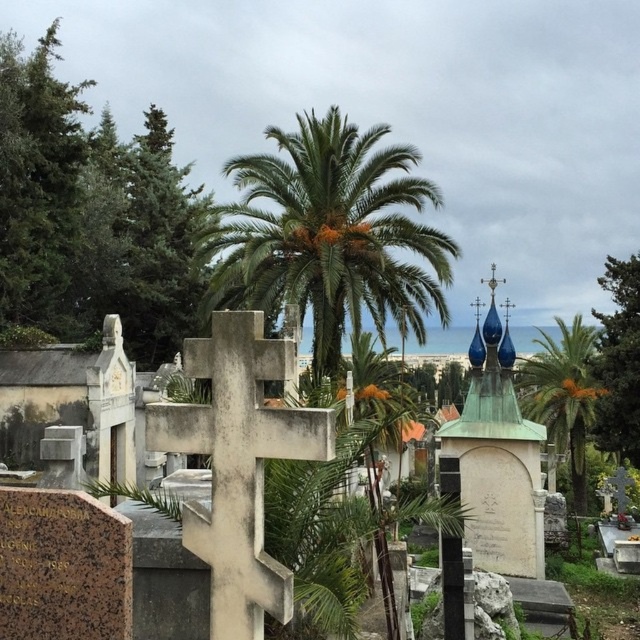
You are standing at the entrance of the cemetery and want to locate the white stone cross at center and the green leafy tree at upper right. Based on their positions, which one would you see first as you walk towards the center of the cemetery?

The white stone cross at center is located above the green leafy tree at upper right, so you would see the white stone cross at center first as you walk towards the center of the cemetery.

You are a groundskeeper in the cemetery and need to water both the white stone cross at center and the green leafy tree at upper right. Your watering can has a capacity of 5 gallons and each watering session can cover a distance of 50 feet before needing to refill. How many times will you need to refill your watering can to water both objects?

The distance between the white stone cross at center and the green leafy tree at upper right is 63.30 feet. Since each watering session can cover up to 50 feet, you will need to refill your watering can at least once to water both objects.